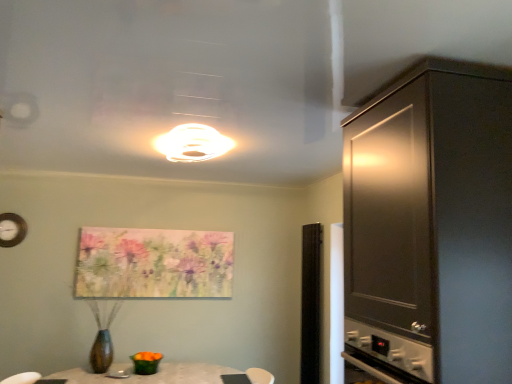
You are a GUI agent. You are given a task and a screenshot of the screen. Output one action in this format:
    pyautogui.click(x=<x>, y=<y>)
    Task: Click on the empty space that is ontop of pastel floral canvas at center (from a real-world perspective)
    Image resolution: width=512 pixels, height=384 pixels.
    Given the screenshot: What is the action you would take?
    pyautogui.click(x=164, y=226)